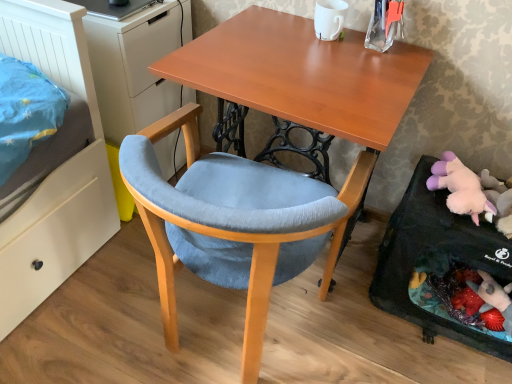
Question: From the image's perspective, would you say matte white dresser at left is shown under fluffy pink plush at lower right?

Choices:
 (A) yes
 (B) no

Answer: (B)

Question: Does matte white dresser at left have a greater height compared to fluffy pink plush at lower right?

Choices:
 (A) no
 (B) yes

Answer: (B)

Question: Is matte white dresser at left closer to the viewer compared to fluffy pink plush at lower right?

Choices:
 (A) yes
 (B) no

Answer: (B)

Question: Is matte white dresser at left smaller than fluffy pink plush at lower right?

Choices:
 (A) no
 (B) yes

Answer: (A)

Question: Is matte white dresser at left further to camera compared to fluffy pink plush at lower right?

Choices:
 (A) no
 (B) yes

Answer: (B)

Question: Does point (407, 266) appear closer or farther from the camera than point (291, 188)?

Choices:
 (A) farther
 (B) closer

Answer: (A)

Question: Visually, is fluffy pink stuffed animal at lower right positioned to the left or to the right of velvet blue chair at center?

Choices:
 (A) right
 (B) left

Answer: (A)

Question: Considering their positions, is fluffy pink stuffed animal at lower right located in front of or behind velvet blue chair at center?

Choices:
 (A) behind
 (B) front

Answer: (A)

Question: From the image's perspective, is fluffy pink stuffed animal at lower right above or below velvet blue chair at center?

Choices:
 (A) below
 (B) above

Answer: (A)

Question: Considering their positions, is wooden desk at center located in front of or behind fluffy pink stuffed animal at lower right?

Choices:
 (A) front
 (B) behind

Answer: (A)

Question: Is wooden desk at center taller or shorter than fluffy pink stuffed animal at lower right?

Choices:
 (A) tall
 (B) short

Answer: (A)

Question: Is wooden desk at center wider or thinner than fluffy pink stuffed animal at lower right?

Choices:
 (A) thin
 (B) wide

Answer: (B)

Question: In the image, is wooden desk at center on the left side or the right side of fluffy pink stuffed animal at lower right?

Choices:
 (A) left
 (B) right

Answer: (A)

Question: Is fluffy pink plush at lower right wider or thinner than matte white dresser at left?

Choices:
 (A) thin
 (B) wide

Answer: (A)

Question: Considering the positions of fluffy pink plush at lower right and matte white dresser at left in the image, is fluffy pink plush at lower right taller or shorter than matte white dresser at left?

Choices:
 (A) tall
 (B) short

Answer: (B)